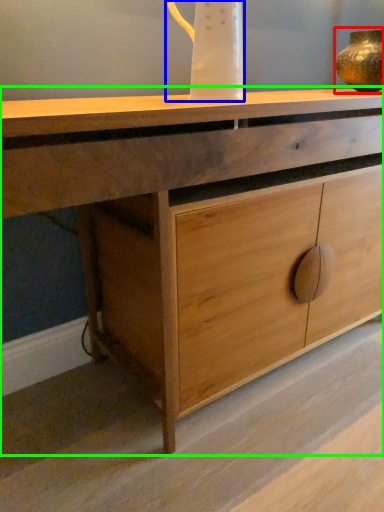
Question: Which is nearer to the candle holder (highlighted by a red box)? jug (highlighted by a blue box) or chest of drawers (highlighted by a green box).

Choices:
 (A) jug
 (B) chest of drawers

Answer: (A)